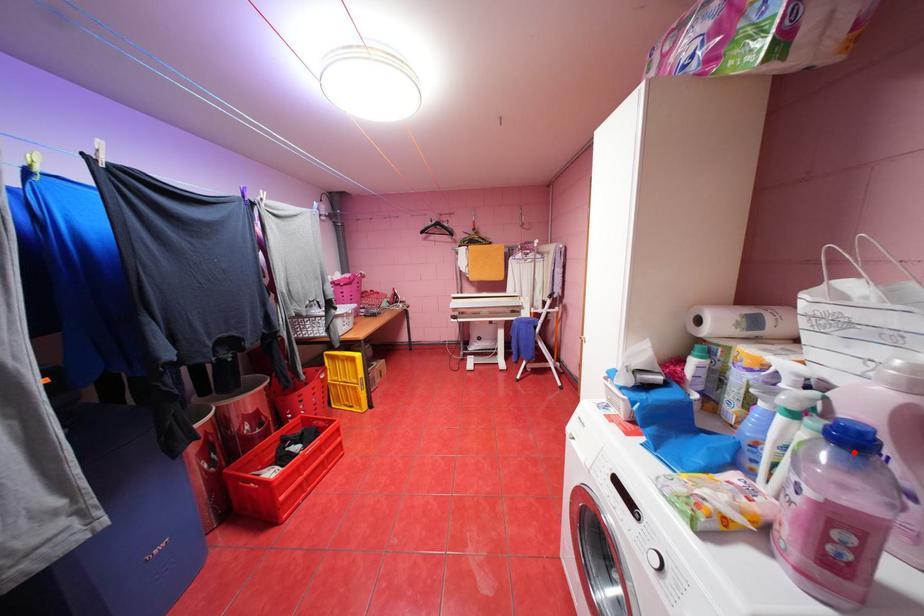
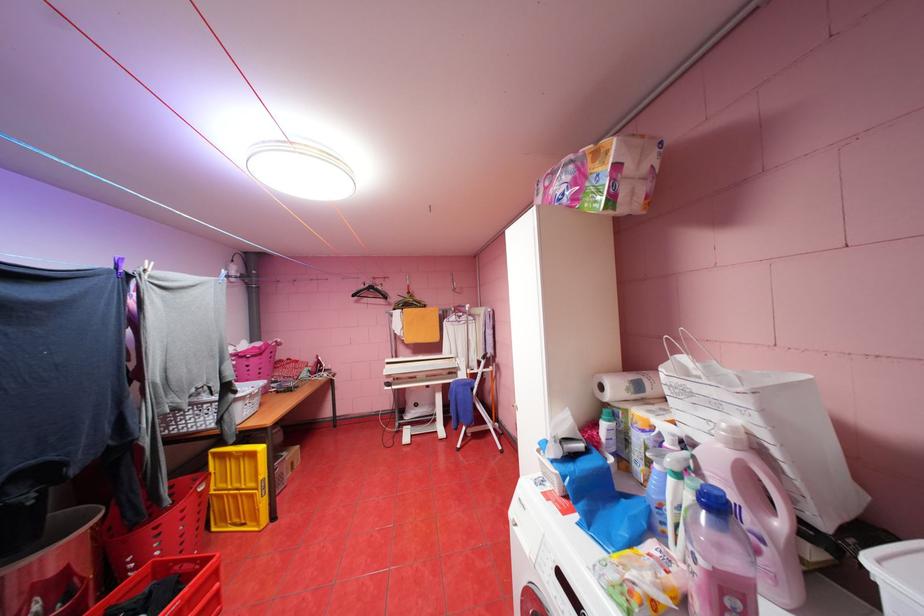
Locate, in the second image, the point that corresponds to the highlighted location in the first image.

(723, 517)